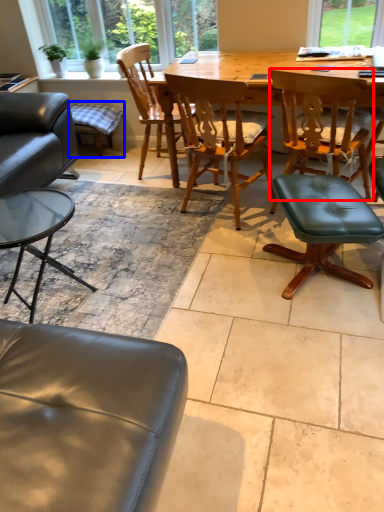
Question: Which of the following is the closest to the observer, chair (highlighted by a red box) or bar stool (highlighted by a blue box)?

Choices:
 (A) chair
 (B) bar stool

Answer: (A)